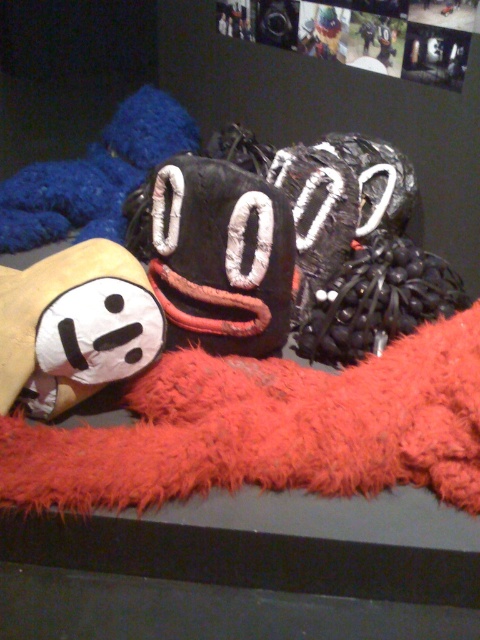
Question: Is the position of white plush toy at center less distant than that of fuzzy blue plush at upper left?

Choices:
 (A) no
 (B) yes

Answer: (B)

Question: Is white plush toy at center wider than fuzzy blue plush at upper left?

Choices:
 (A) no
 (B) yes

Answer: (A)

Question: Among these points, which one is nearest to the camera?

Choices:
 (A) (39, 349)
 (B) (141, 92)

Answer: (A)

Question: Can you confirm if white plush toy at center is thinner than fuzzy blue plush at upper left?

Choices:
 (A) yes
 (B) no

Answer: (A)

Question: Which point appears closest to the camera in this image?

Choices:
 (A) (13, 388)
 (B) (143, 93)

Answer: (A)